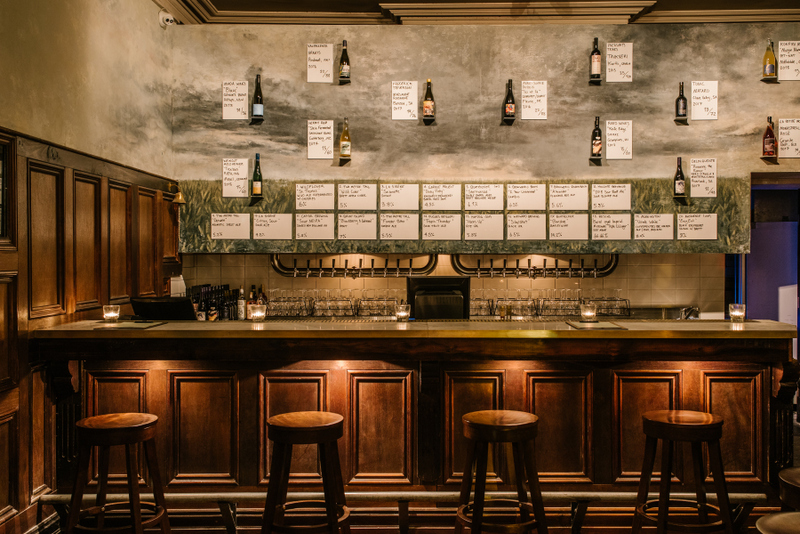
I want to click on barstools, so click(x=680, y=439), click(x=508, y=436), click(x=305, y=424), click(x=110, y=436).